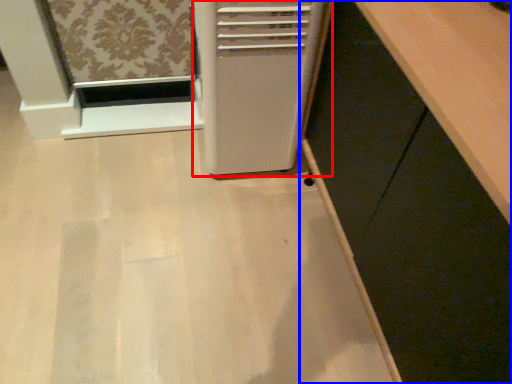
Question: Which of the following is the farthest to the observer, home appliance (highlighted by a red box) or cabinetry (highlighted by a blue box)?

Choices:
 (A) home appliance
 (B) cabinetry

Answer: (A)